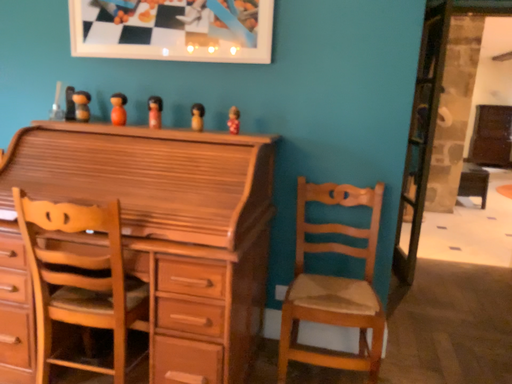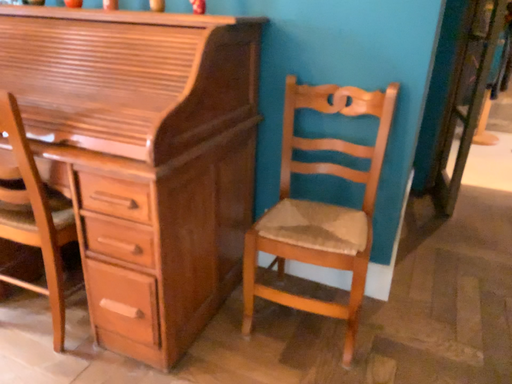
Question: Which way did the camera rotate in the video?

Choices:
 (A) rotated left
 (B) rotated right

Answer: (A)